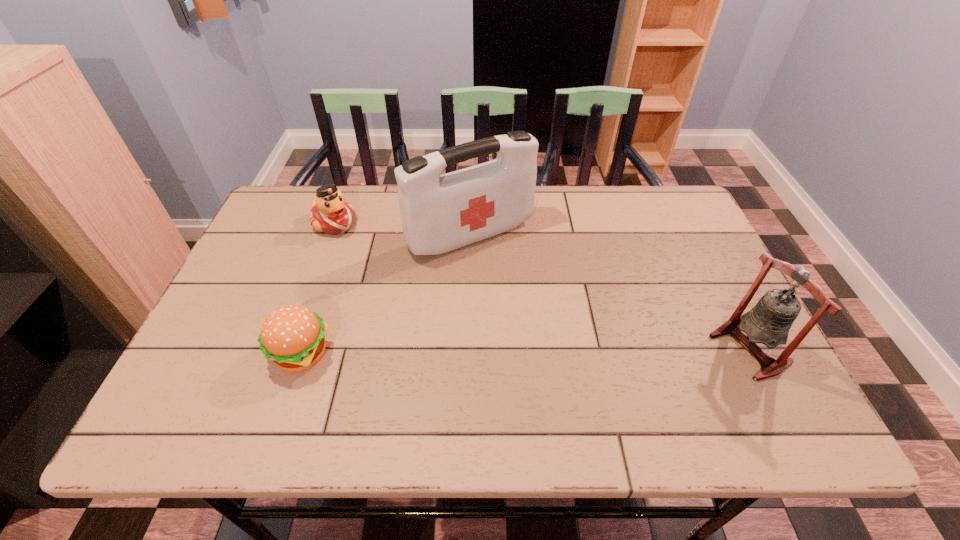
Locate an element on the screen. vacant region at the far edge of the desktop is located at coordinates (545, 197).

In order to click on vacant space at the left edge of the desktop in this screenshot , I will do `click(253, 315)`.

At what (x,y) coordinates should I click in order to perform the action: click on vacant region at the right edge. Please return your answer as a coordinate pair (x, y). This screenshot has height=540, width=960. Looking at the image, I should click on (687, 326).

Image resolution: width=960 pixels, height=540 pixels. In the image, there is a desktop. Identify the location of vacant space at the far left corner. (295, 208).

The width and height of the screenshot is (960, 540). In order to click on vacant space at the near left corner of the desktop in this screenshot , I will do `click(228, 379)`.

The image size is (960, 540). Identify the location of vacant space at the far right corner. (645, 185).

This screenshot has height=540, width=960. I want to click on free spot between the hamburger and the third object from left to right, so click(386, 294).

Locate an element on the screen. The image size is (960, 540). unoccupied position between the hamburger and the bell is located at coordinates [525, 351].

Image resolution: width=960 pixels, height=540 pixels. Find the location of `empty space between the duck and the rightmost object`. empty space between the duck and the rightmost object is located at coordinates click(542, 286).

This screenshot has height=540, width=960. What are the coordinates of `vacant space that's between the duck and the rightmost object` in the screenshot? It's located at (542, 286).